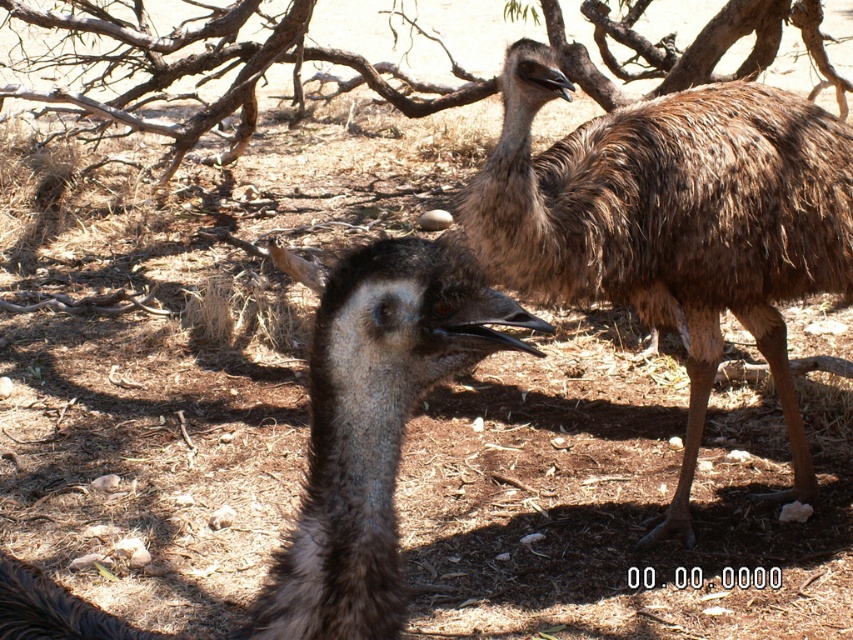
Question: Can you confirm if brown fuzzy ostrich at upper right is wider than brown textured branches at upper center?

Choices:
 (A) no
 (B) yes

Answer: (B)

Question: Can you confirm if brown fuzzy ostrich at upper right is positioned below brown feathered ostrich at center?

Choices:
 (A) yes
 (B) no

Answer: (B)

Question: Where is brown fuzzy ostrich at upper right located in relation to brown feathered ostrich at center in the image?

Choices:
 (A) above
 (B) below

Answer: (A)

Question: Which object is farther from the camera taking this photo?

Choices:
 (A) brown textured branches at upper center
 (B) brown fuzzy ostrich at upper right

Answer: (A)

Question: Which object is closer to the camera taking this photo?

Choices:
 (A) brown textured branches at upper center
 (B) brown feathered ostrich at center

Answer: (B)

Question: Which point is closer to the camera taking this photo?

Choices:
 (A) (289, 122)
 (B) (367, 392)

Answer: (B)